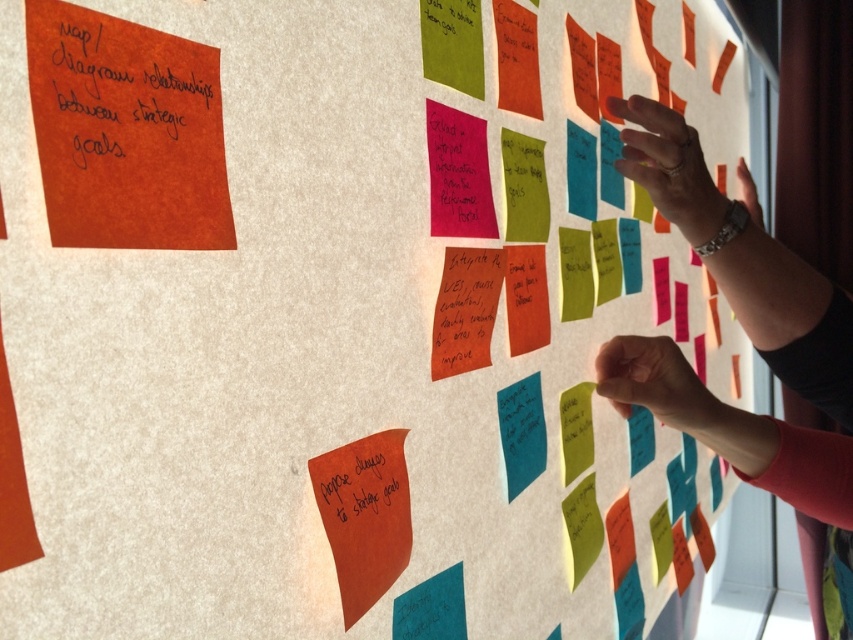
You are organizing a meeting agenda and need to reference both the metallic wristwatch at upper right and the matte orange sticky note at bottom left. Since you can only focus on one at a time, which object should you look at first based on their positions?

You should look at the metallic wristwatch at upper right first because it is located above the matte orange sticky note at bottom left, making it easier to see without moving your gaze downward.

You are organizing the sticky notes on the wall and notice two points marked on the wall at coordinates point (820, 481) and point (367, 449). From your perspective standing in front of the wall, which point is closer to you?

Point (367, 449) is closer to you because point (820, 481) is behind it.

You are an office worker organizing the wall of sticky notes. You notice the orange matte sticky note at upper left and the orange matte paper at upper left. Which object is closer to you?

The orange matte sticky note at upper left is closer to you because it is further to the viewer than the orange matte paper at upper left.